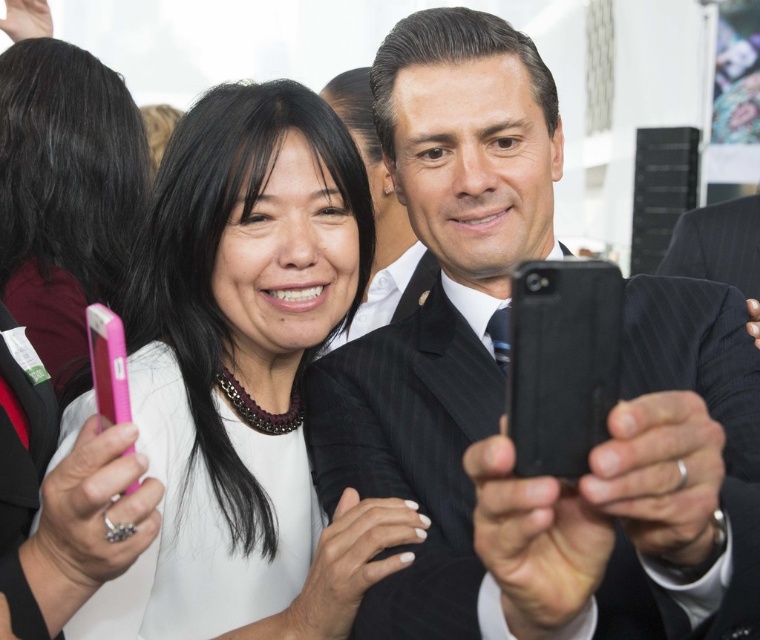
Can you confirm if matte black suit at center is positioned above white matte dress at center?

No.

Between point (705, 426) and point (296, 422), which one is positioned behind?

The point (296, 422) is behind.

Image resolution: width=760 pixels, height=640 pixels. Identify the location of matte black suit at center. (504, 387).

Between matte black suit at center and pink plastic phone at left, which one is positioned lower?

matte black suit at center

Image resolution: width=760 pixels, height=640 pixels. In order to click on matte black suit at center in this screenshot , I will do `click(504, 387)`.

In order to click on matte black suit at center in this screenshot , I will do `click(504, 387)`.

Between white matte dress at center and pink plastic phone at left, which one is positioned lower?

Positioned lower is white matte dress at center.

Is white matte dress at center positioned at the back of pink plastic phone at left?

No, it is not.

Is point (340, 612) closer to camera compared to point (46, 284)?

Yes, it is in front of point (46, 284).

This screenshot has height=640, width=760. What are the coordinates of `white matte dress at center` in the screenshot? It's located at (252, 369).